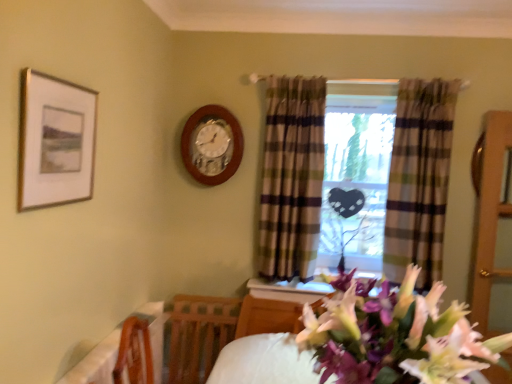
Question: Can you confirm if clear glass door at right is positioned to the left of plaid fabric curtain at center, the second curtain viewed from the left?

Choices:
 (A) no
 (B) yes

Answer: (A)

Question: Is clear glass door at right closer to the viewer compared to plaid fabric curtain at center, the second curtain viewed from the left?

Choices:
 (A) yes
 (B) no

Answer: (A)

Question: Would you say clear glass door at right contains plaid fabric curtain at center, which is the first curtain in right-to-left order?

Choices:
 (A) yes
 (B) no

Answer: (B)

Question: Could you tell me if clear glass door at right is turned towards plaid fabric curtain at center, which is the first curtain in right-to-left order?

Choices:
 (A) yes
 (B) no

Answer: (B)

Question: Are clear glass door at right and plaid fabric curtain at center, the second curtain viewed from the left, located far from each other?

Choices:
 (A) yes
 (B) no

Answer: (B)

Question: From the image's perspective, is clear glass door at right located beneath plaid fabric curtain at center, the second curtain viewed from the left?

Choices:
 (A) yes
 (B) no

Answer: (A)

Question: Would you consider plaid fabric curtain at center, the second curtain from the right, to be distant from gold-framed picture at upper left?

Choices:
 (A) yes
 (B) no

Answer: (A)

Question: Can you confirm if plaid fabric curtain at center, the second curtain from the right, is smaller than gold-framed picture at upper left?

Choices:
 (A) no
 (B) yes

Answer: (A)

Question: From the image's perspective, is plaid fabric curtain at center, arranged as the 1th curtain when viewed from the left, on gold-framed picture at upper left?

Choices:
 (A) yes
 (B) no

Answer: (B)

Question: Is plaid fabric curtain at center, the second curtain from the right, not within gold-framed picture at upper left?

Choices:
 (A) no
 (B) yes

Answer: (B)

Question: From a real-world perspective, is plaid fabric curtain at center, arranged as the 1th curtain when viewed from the left, beneath gold-framed picture at upper left?

Choices:
 (A) no
 (B) yes

Answer: (B)

Question: From the image's perspective, is plaid fabric curtain at center, the second curtain from the right, beneath gold-framed picture at upper left?

Choices:
 (A) yes
 (B) no

Answer: (A)

Question: Would you say gold-framed picture at upper left is a long distance from wooden table at lower left?

Choices:
 (A) yes
 (B) no

Answer: (B)